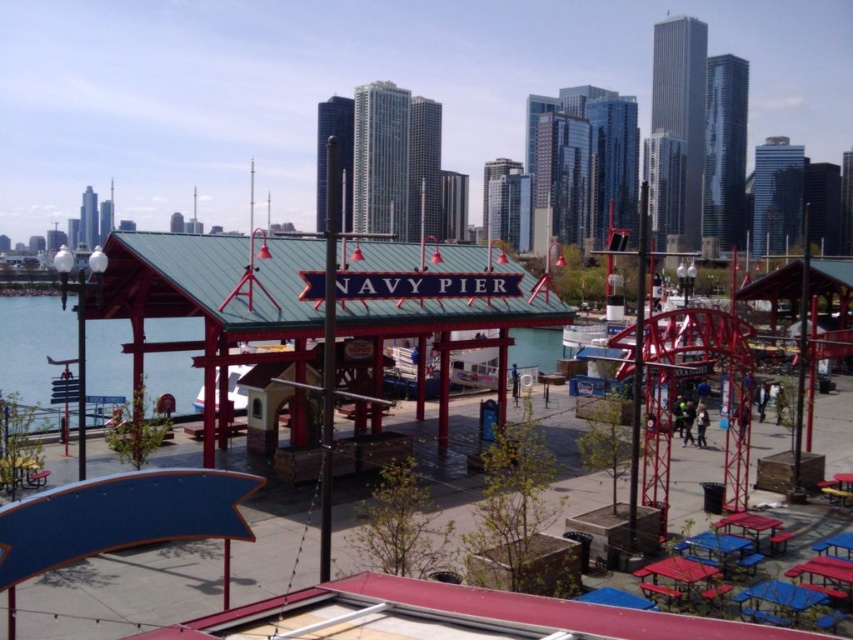
You are planning to set up a picnic at Navy Pier and have brought a large blanket that requires a picnic table with a minimum width of 1.2 meters. You see a blue plastic picnic table at lower right and a red plastic picnic table at lower right. Which table should you choose to accommodate your blanket?

The blue plastic picnic table at lower right might be wider than red plastic picnic table at lower right, so it is more likely to accommodate your large blanket requiring a minimum width of 1.2 meters.

You are planning to host a small gathering at Navy Pier and need to choose between the wooden picnic table at lower right and the blue plastic picnic table at lower right. Based on their sizes, which table would be more suitable for accommodating 6 people comfortably?

The blue plastic picnic table at lower right is larger, making it more suitable for accommodating 6 people comfortably.

You are planning to set up a small event at Navy Pier and need to place a banner. The banner requires a support structure that must be positioned at coordinates between 0.8 and 0.9 on the x and y axes. Is the wooden picnic table at lower right suitable for this purpose?

The wooden picnic table at lower right is located at point (680,579), which falls within the required coordinates between 0.8 and 0.9 on both axes. Therefore, the wooden picnic table at lower right is suitable for placing the banner support structure.